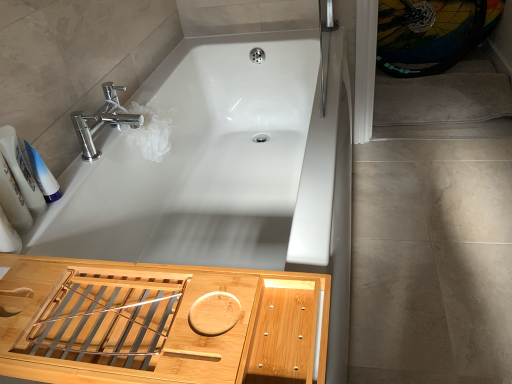
Question: Is white glossy bathtub at center oriented towards gray carpet at right?

Choices:
 (A) yes
 (B) no

Answer: (B)

Question: From the image's perspective, is white glossy bathtub at center under gray carpet at right?

Choices:
 (A) yes
 (B) no

Answer: (A)

Question: Is the position of white glossy bathtub at center more distant than that of gray carpet at right?

Choices:
 (A) no
 (B) yes

Answer: (A)

Question: Does white glossy bathtub at center have a greater width compared to gray carpet at right?

Choices:
 (A) yes
 (B) no

Answer: (B)

Question: Is white glossy bathtub at center at the left side of gray carpet at right?

Choices:
 (A) no
 (B) yes

Answer: (B)

Question: Is white glossy bathtub at center positioned with its back to gray carpet at right?

Choices:
 (A) yes
 (B) no

Answer: (B)

Question: Is the depth of beige tile floor at lower right greater than that of white glossy bottles at left, the 1th toiletry positioned from the left?

Choices:
 (A) yes
 (B) no

Answer: (A)

Question: Would you say beige tile floor at lower right is outside white glossy bottles at left, the second toiletry from the right?

Choices:
 (A) no
 (B) yes

Answer: (B)

Question: From a real-world perspective, is beige tile floor at lower right beneath white glossy bottles at left, the second toiletry from the right?

Choices:
 (A) no
 (B) yes

Answer: (B)

Question: Considering the relative sizes of beige tile floor at lower right and white glossy bottles at left, the 1th toiletry positioned from the left, in the image provided, is beige tile floor at lower right taller than white glossy bottles at left, the 1th toiletry positioned from the left,?

Choices:
 (A) yes
 (B) no

Answer: (B)

Question: Could white glossy bottles at left, the 1th toiletry positioned from the left, be considered to be inside beige tile floor at lower right?

Choices:
 (A) no
 (B) yes

Answer: (A)

Question: Is beige tile floor at lower right facing away from white glossy bottles at left, the second toiletry from the right?

Choices:
 (A) no
 (B) yes

Answer: (A)

Question: Is white plastic tube at left, which is counted as the 1th toiletry, starting from the right, far away from white glossy bottles at left, the second toiletry from the right?

Choices:
 (A) yes
 (B) no

Answer: (B)